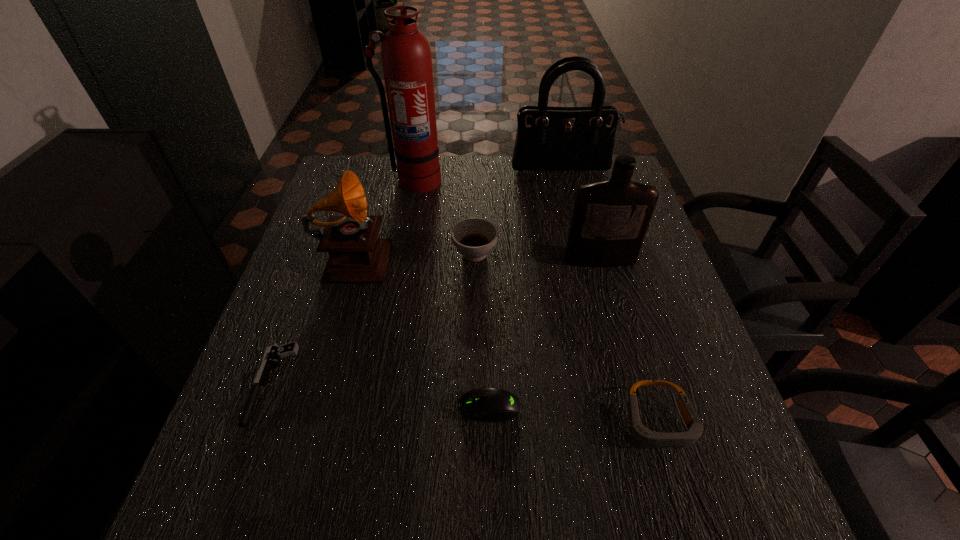
Where is `vacant space located on the label side of the liquor`? This screenshot has height=540, width=960. vacant space located on the label side of the liquor is located at coordinates (644, 423).

Locate an element on the screen. This screenshot has height=540, width=960. vacant space situated on the horn of the phonograph record is located at coordinates (410, 254).

Where is `free region located 0.070m on the right of the fifth tallest object`? This screenshot has height=540, width=960. free region located 0.070m on the right of the fifth tallest object is located at coordinates (525, 253).

In order to click on vacant area located on the front and back of the third shortest object in this screenshot , I will do `click(679, 491)`.

The width and height of the screenshot is (960, 540). In order to click on vacant space positioned 0.350m on the wheel side of the second shortest object in this screenshot , I will do `click(271, 407)`.

Locate an element on the screen. This screenshot has width=960, height=540. vacant space located on the wheel side of the second shortest object is located at coordinates (426, 407).

The width and height of the screenshot is (960, 540). I want to click on free space located on the wheel side of the second shortest object, so click(377, 407).

The image size is (960, 540). Find the location of `fire extinguisher at the far edge`. fire extinguisher at the far edge is located at coordinates (406, 58).

At what (x,y) coordinates should I click in order to perform the action: click on handbag present at the far edge. Please return your answer as a coordinate pair (x, y). The image size is (960, 540). Looking at the image, I should click on (548, 138).

The height and width of the screenshot is (540, 960). What are the coordinates of `phonograph record present at the left edge` in the screenshot? It's located at [x=356, y=255].